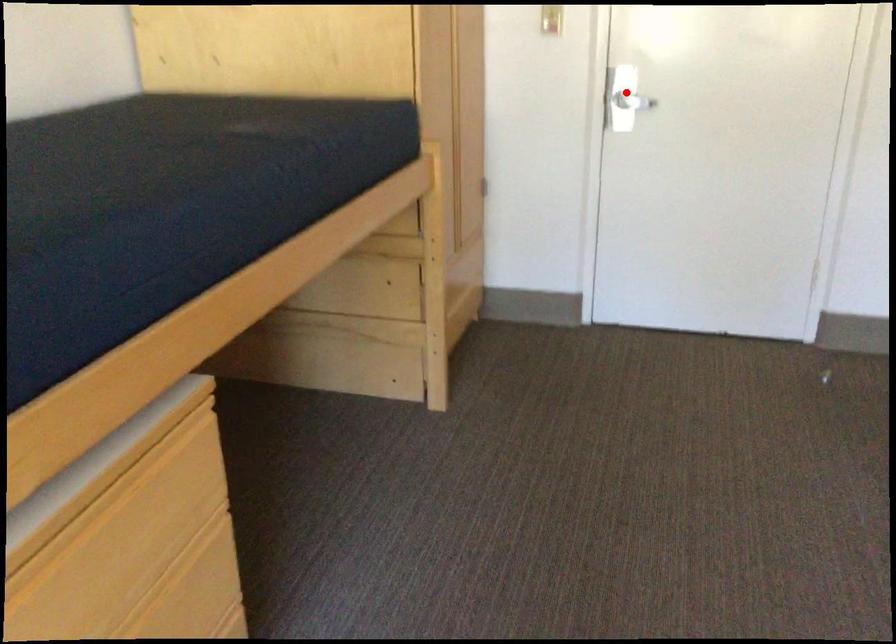
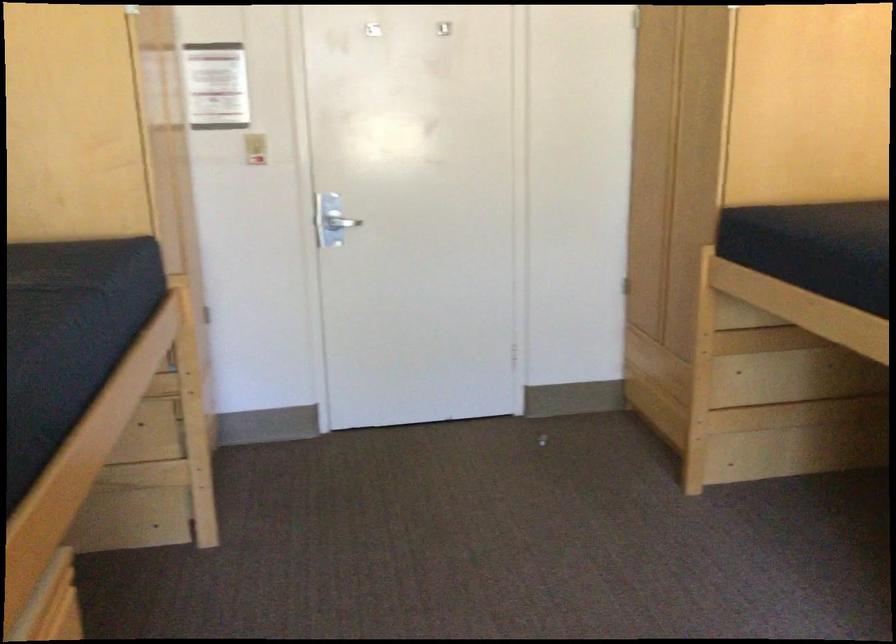
Question: I am providing you with two images of the same scene from different viewpoints. A red point is marked on the first image. Is the red point's position out of view in image 2?

Choices:
 (A) Yes
 (B) No

Answer: (B)